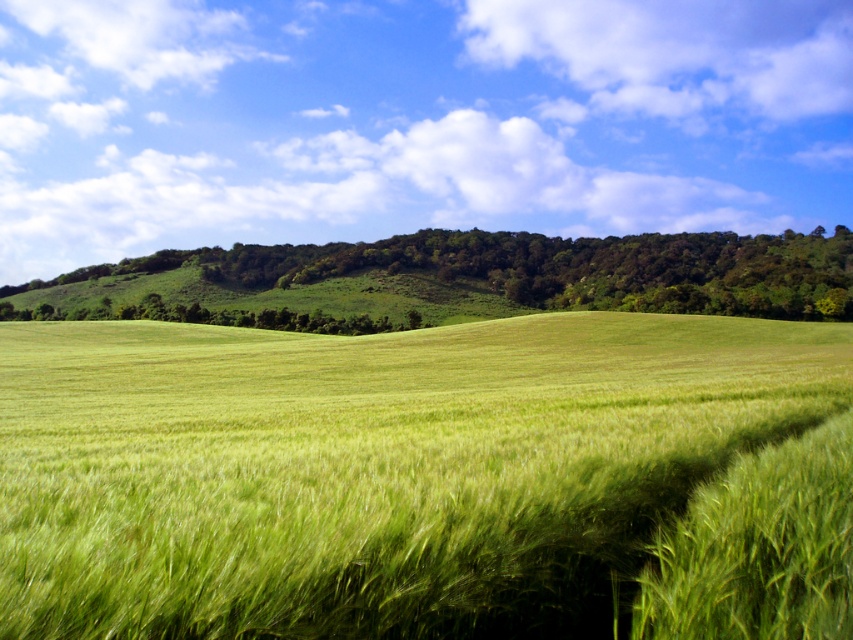
Does green grassy field at center have a lesser width compared to green grassy hillside at center?

Yes.

This screenshot has height=640, width=853. What do you see at coordinates (370, 468) in the screenshot?
I see `green grassy field at center` at bounding box center [370, 468].

Where is `green grassy field at center`? green grassy field at center is located at coordinates (370, 468).